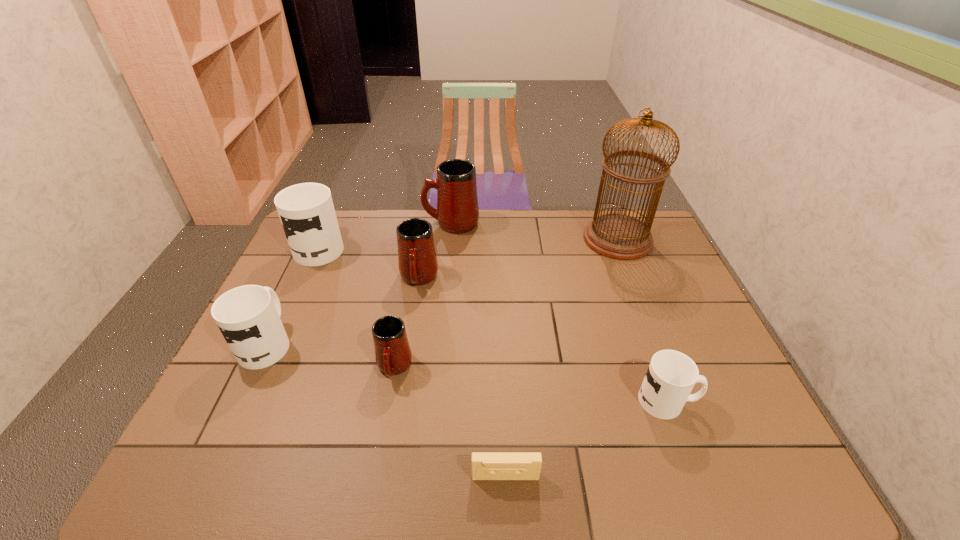
At what (x,y) coordinates should I click in order to perform the action: click on vacant point located between the second biggest red mug and the beige videotape. Please return your answer as a coordinate pair (x, y). Looking at the image, I should click on (462, 377).

The image size is (960, 540). Find the location of `vacant area that lies between the second farthest white mug and the farthest red mug`. vacant area that lies between the second farthest white mug and the farthest red mug is located at coordinates (359, 282).

Locate an element on the screen. This screenshot has width=960, height=540. vacant point located between the second biggest red mug and the birdcage is located at coordinates tap(518, 259).

I want to click on free space between the tallest object and the biggest red mug, so click(x=535, y=231).

Locate which object ranks fifth in proximity to the smallest white mug. Please provide its 2D coordinates. Your answer should be formatted as a tuple, i.e. [(x, y)], where the tuple contains the x and y coordinates of a point satisfying the conditions above.

[(457, 212)]

Locate which object ranks fifth in proximity to the smallest white mug. Please provide its 2D coordinates. Your answer should be formatted as a tuple, i.e. [(x, y)], where the tuple contains the x and y coordinates of a point satisfying the conditions above.

[(457, 212)]

Select which mug appears as the fifth closest to the farthest white mug. Please provide its 2D coordinates. Your answer should be formatted as a tuple, i.e. [(x, y)], where the tuple contains the x and y coordinates of a point satisfying the conditions above.

[(671, 375)]

Identify which mug is the nearest to the nearest red mug. Please provide its 2D coordinates. Your answer should be formatted as a tuple, i.e. [(x, y)], where the tuple contains the x and y coordinates of a point satisfying the conditions above.

[(417, 261)]

Locate an element on the screen. The width and height of the screenshot is (960, 540). red mug that is the second nearest to the biggest red mug is located at coordinates (393, 355).

You are a GUI agent. You are given a task and a screenshot of the screen. Output one action in this format:
    pyautogui.click(x=<x>, y=<y>)
    Task: Click on the red mug that is the second closest to the farthest white mug
    The width and height of the screenshot is (960, 540).
    Given the screenshot: What is the action you would take?
    pyautogui.click(x=457, y=212)